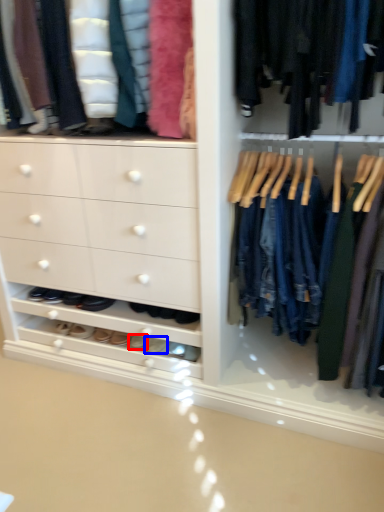
Question: Which object appears closest to the camera in this image, footwear (highlighted by a red box) or footwear (highlighted by a blue box)?

Choices:
 (A) footwear
 (B) footwear

Answer: (B)